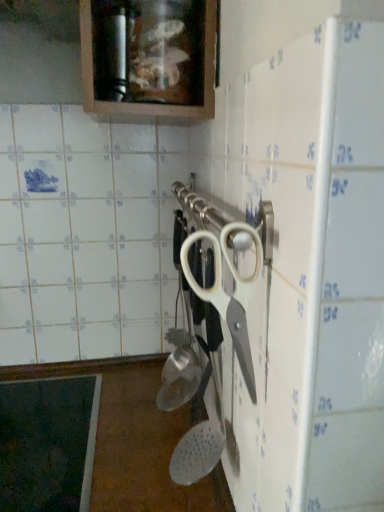
Question: Does white plastic scissors at center contain matte wood cabinet at upper center?

Choices:
 (A) yes
 (B) no

Answer: (B)

Question: Is white plastic scissors at center at the right side of matte wood cabinet at upper center?

Choices:
 (A) no
 (B) yes

Answer: (B)

Question: Is white plastic scissors at center shorter than matte wood cabinet at upper center?

Choices:
 (A) yes
 (B) no

Answer: (B)

Question: Are white plastic scissors at center and matte wood cabinet at upper center making contact?

Choices:
 (A) yes
 (B) no

Answer: (B)

Question: Is white plastic scissors at center outside matte wood cabinet at upper center?

Choices:
 (A) no
 (B) yes

Answer: (B)

Question: From a real-world perspective, does white plastic scissors at center sit lower than matte wood cabinet at upper center?

Choices:
 (A) yes
 (B) no

Answer: (A)

Question: Is matte wood cabinet at upper center aimed at white plastic scissors at center?

Choices:
 (A) yes
 (B) no

Answer: (B)

Question: Is there a large distance between matte wood cabinet at upper center and white plastic scissors at center?

Choices:
 (A) no
 (B) yes

Answer: (A)

Question: Is matte wood cabinet at upper center outside white plastic scissors at center?

Choices:
 (A) yes
 (B) no

Answer: (A)

Question: Is matte wood cabinet at upper center behind white plastic scissors at center?

Choices:
 (A) yes
 (B) no

Answer: (A)

Question: From a real-world perspective, does matte wood cabinet at upper center sit lower than white plastic scissors at center?

Choices:
 (A) no
 (B) yes

Answer: (A)

Question: Can you confirm if matte wood cabinet at upper center is thinner than white plastic scissors at center?

Choices:
 (A) yes
 (B) no

Answer: (B)

Question: From a real-world perspective, relative to white plastic scissors at center, is matte wood cabinet at upper center vertically above or below?

Choices:
 (A) above
 (B) below

Answer: (A)